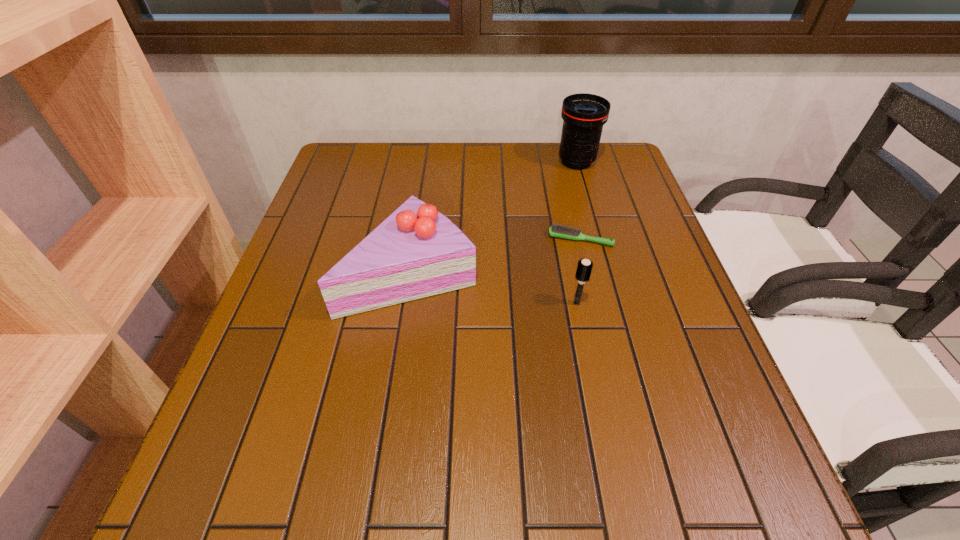
Find the location of a particular element. object that is at the far edge is located at coordinates (583, 114).

In order to click on object located at the left edge in this screenshot , I will do `click(416, 252)`.

This screenshot has height=540, width=960. Identify the location of telephoto lens present at the right edge. (583, 114).

The height and width of the screenshot is (540, 960). Find the location of `hairbrush present at the right edge`. hairbrush present at the right edge is located at coordinates (560, 231).

Find the location of a particular element. This screenshot has width=960, height=540. object that is at the far right corner is located at coordinates (583, 114).

Where is `free region at the far edge of the desktop`? Image resolution: width=960 pixels, height=540 pixels. free region at the far edge of the desktop is located at coordinates (455, 143).

In the image, there is a desktop. Find the location of `free space at the near edge`. free space at the near edge is located at coordinates (483, 515).

The image size is (960, 540). In the image, there is a desktop. What are the coordinates of `free space at the left edge` in the screenshot? It's located at (332, 199).

In the image, there is a desktop. At what (x,y) coordinates should I click in order to perform the action: click on vacant region at the right edge. Please return your answer as a coordinate pair (x, y). Looking at the image, I should click on (636, 281).

Identify the location of free space at the far left corner. (354, 142).